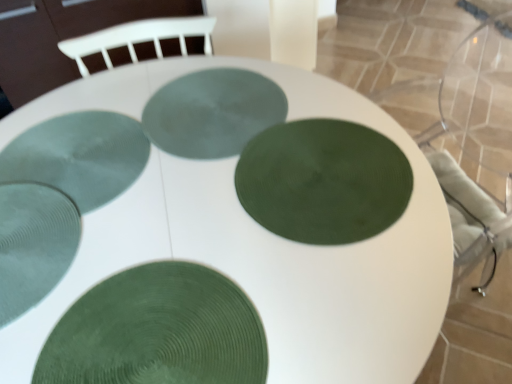
At what (x,y) coordinates should I click in order to perform the action: click on empty space that is in between green textured plate at center, which appears as the first glass plate when viewed from the front, and clear textured glass at bottom left, positioned as the 2th glass plate in front-to-back order. Please return your answer as a coordinate pair (x, y). The image size is (512, 384). Looking at the image, I should click on (118, 249).